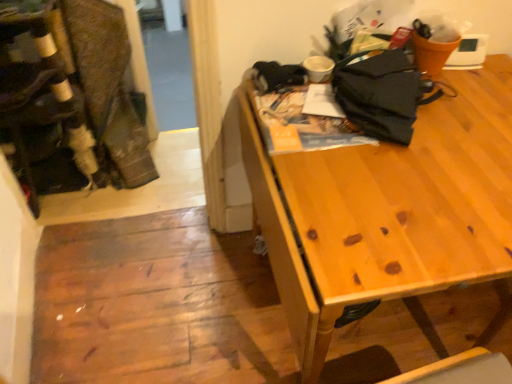
Question: Is black fabric umbrella at upper right outside brown textured fabric laundry at left?

Choices:
 (A) yes
 (B) no

Answer: (A)

Question: Considering the relative sizes of black fabric umbrella at upper right and brown textured fabric laundry at left in the image provided, is black fabric umbrella at upper right thinner than brown textured fabric laundry at left?

Choices:
 (A) no
 (B) yes

Answer: (B)

Question: Is black fabric umbrella at upper right positioned before brown textured fabric laundry at left?

Choices:
 (A) yes
 (B) no

Answer: (A)

Question: Is black fabric umbrella at upper right at the right side of brown textured fabric laundry at left?

Choices:
 (A) yes
 (B) no

Answer: (A)

Question: From a real-world perspective, does black fabric umbrella at upper right sit lower than brown textured fabric laundry at left?

Choices:
 (A) no
 (B) yes

Answer: (A)

Question: Could you tell me if black fabric umbrella at upper right is turned towards brown textured fabric laundry at left?

Choices:
 (A) yes
 (B) no

Answer: (B)

Question: Are velvet-like fabric at left and brown textured fabric laundry at left located far from each other?

Choices:
 (A) no
 (B) yes

Answer: (A)

Question: Is velvet-like fabric at left to the left of brown textured fabric laundry at left from the viewer's perspective?

Choices:
 (A) no
 (B) yes

Answer: (B)

Question: From a real-world perspective, is velvet-like fabric at left over brown textured fabric laundry at left?

Choices:
 (A) yes
 (B) no

Answer: (A)

Question: Is velvet-like fabric at left thinner than brown textured fabric laundry at left?

Choices:
 (A) yes
 (B) no

Answer: (A)

Question: From the image's perspective, is velvet-like fabric at left under brown textured fabric laundry at left?

Choices:
 (A) yes
 (B) no

Answer: (A)

Question: Considering the relative sizes of velvet-like fabric at left and brown textured fabric laundry at left in the image provided, is velvet-like fabric at left bigger than brown textured fabric laundry at left?

Choices:
 (A) no
 (B) yes

Answer: (B)

Question: Considering the relative positions of velvet-like fabric at left and black fabric umbrella at upper right in the image provided, is velvet-like fabric at left to the right of black fabric umbrella at upper right from the viewer's perspective?

Choices:
 (A) yes
 (B) no

Answer: (B)